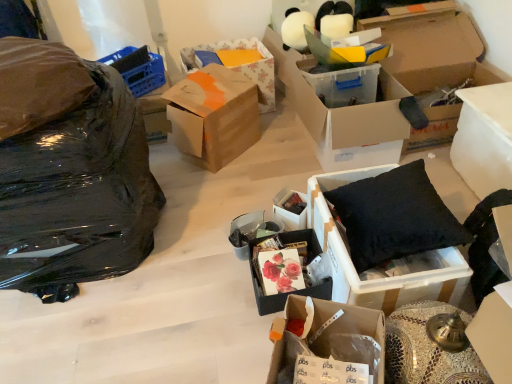
Find the location of a particular element. vacant area on top of matte floral print box at center, the third box in the left-to-right sequence (from a real-world perspective) is located at coordinates (280, 266).